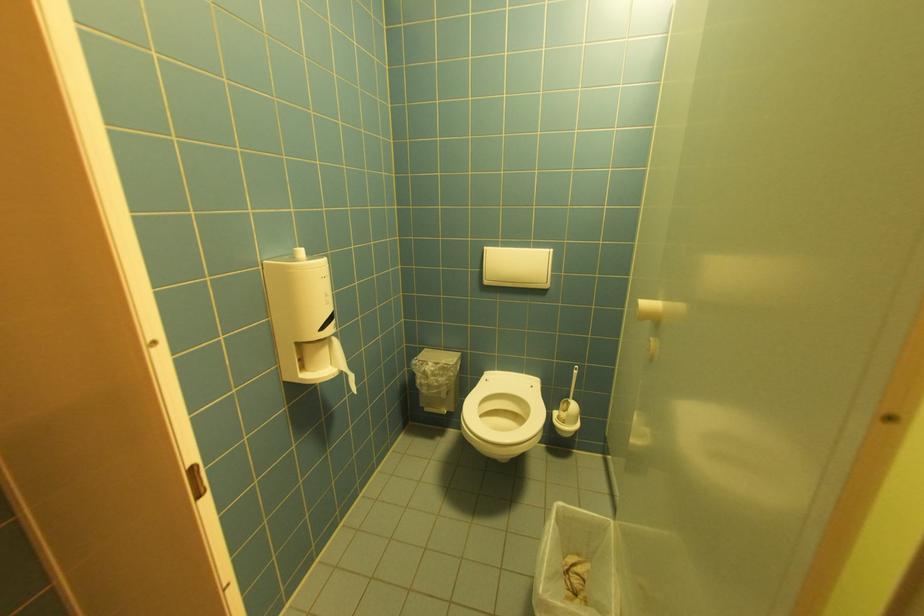
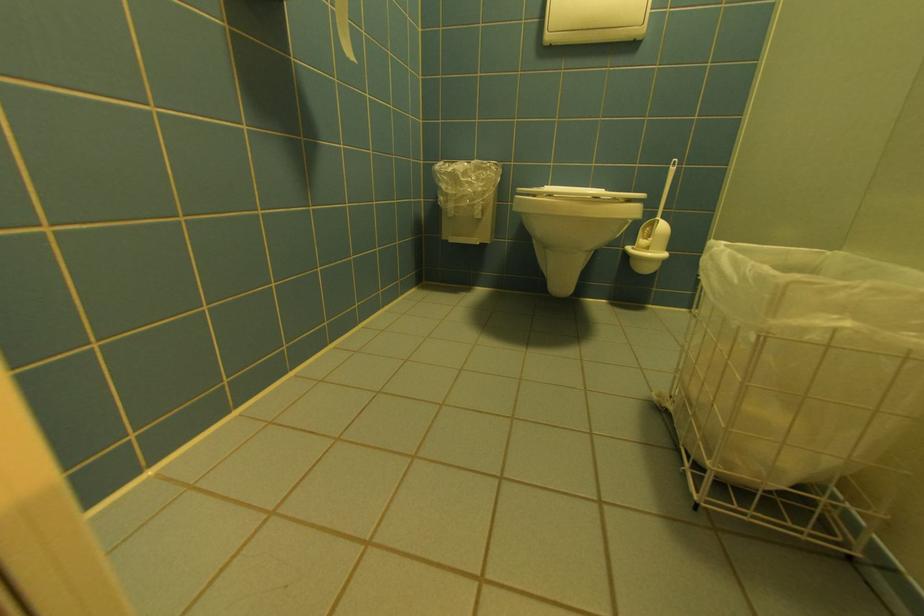
Question: What movement of the cameraman would produce the second image?

Choices:
 (A) Left
 (B) Right
 (C) Forward
 (D) Backward

Answer: (C)